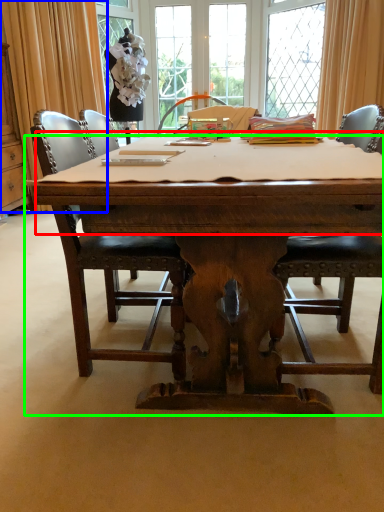
Question: Which object is positioned closest to tablecloth (highlighted by a red box)? Select from curtain (highlighted by a blue box) and desk (highlighted by a green box).

Choices:
 (A) curtain
 (B) desk

Answer: (B)